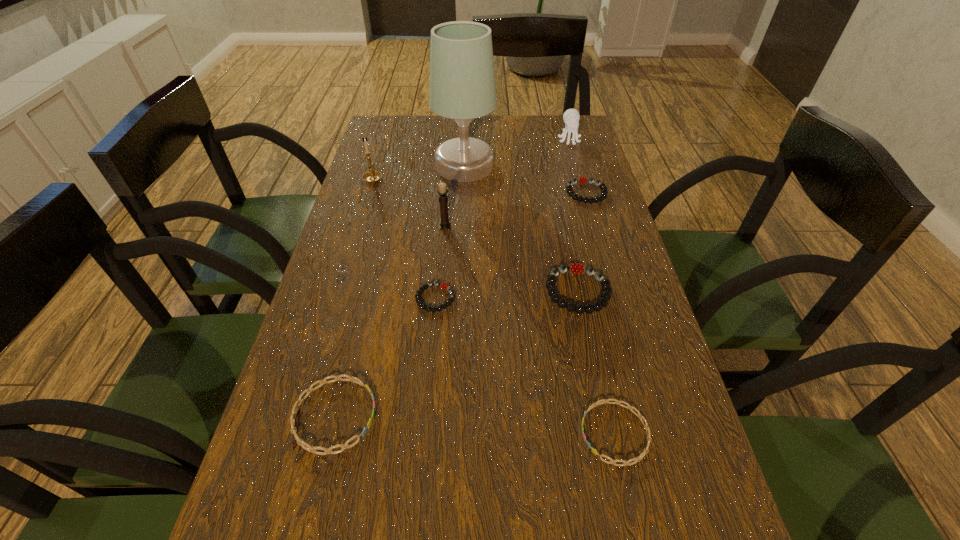
Where is `the tallest object`? the tallest object is located at coordinates (462, 82).

Identify the location of lampshade. The image size is (960, 540). (462, 82).

You are a GUI agent. You are given a task and a screenshot of the screen. Output one action in this format:
    pyautogui.click(x=<x>, y=<y>)
    Task: Click on the gold candle holder
    This screenshot has width=960, height=540.
    Given the screenshot: What is the action you would take?
    pyautogui.click(x=371, y=176)

Find the location of a particular element. The width and height of the screenshot is (960, 540). the farther candle holder is located at coordinates (371, 176).

Identify the location of the nearer candle holder. The width and height of the screenshot is (960, 540). (442, 191).

Where is `the fifth farthest object`? the fifth farthest object is located at coordinates (442, 191).

You are a GUI agent. You are given a task and a screenshot of the screen. Output one action in this format:
    pyautogui.click(x=<x>, y=<y>)
    Task: Click on the octopus
    
    Given the screenshot: What is the action you would take?
    click(x=571, y=117)

Locate an element on the screen. This screenshot has width=960, height=540. the fourth tallest object is located at coordinates (571, 117).

Image resolution: width=960 pixels, height=540 pixels. What are the coordinates of `the tallest bracelet` in the screenshot? It's located at (576, 268).

I want to click on the fifth shortest object, so click(x=576, y=268).